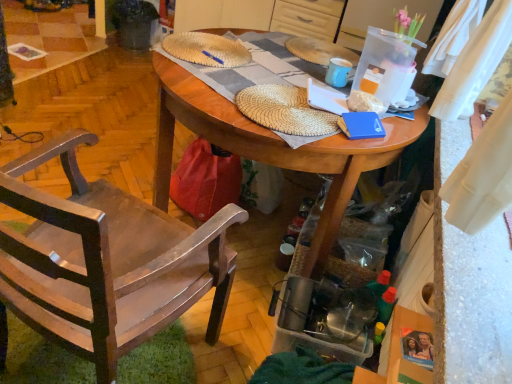
Image resolution: width=512 pixels, height=384 pixels. What are the coordinates of `blank area beneath woven straw hat at upper center, which is the first hat in top-to-bottom order (from a real-world perspective)` in the screenshot? It's located at (201, 44).